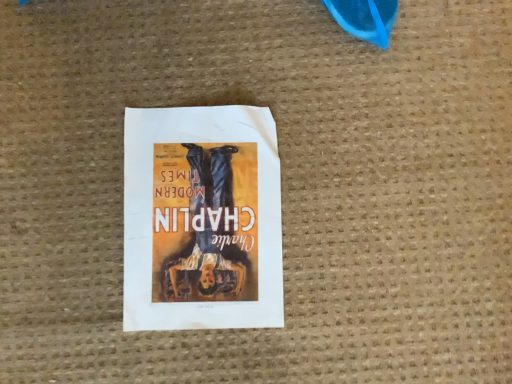
Image resolution: width=512 pixels, height=384 pixels. Find the location of `free space above matte paper poster at center (from a real-world perspective)`. free space above matte paper poster at center (from a real-world perspective) is located at coordinates (197, 216).